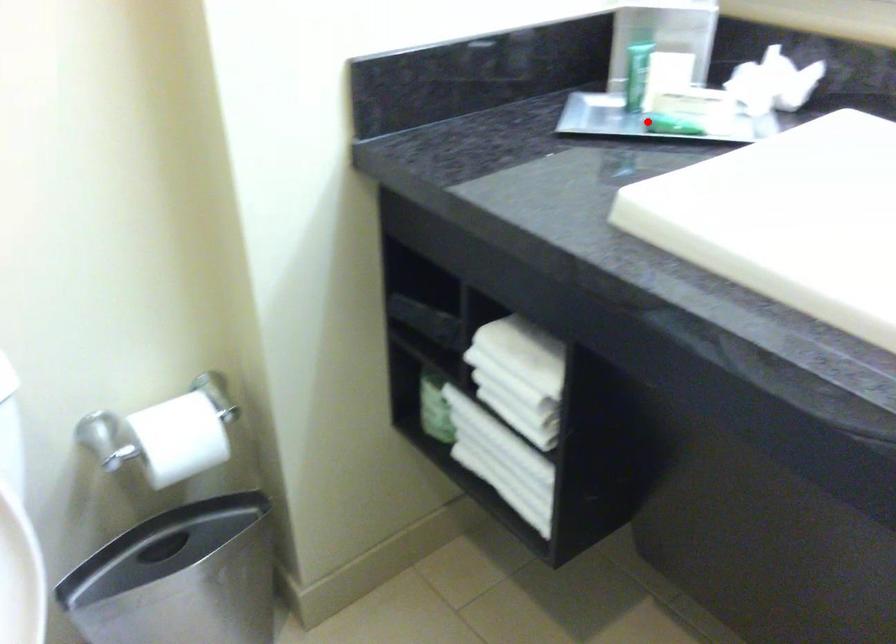
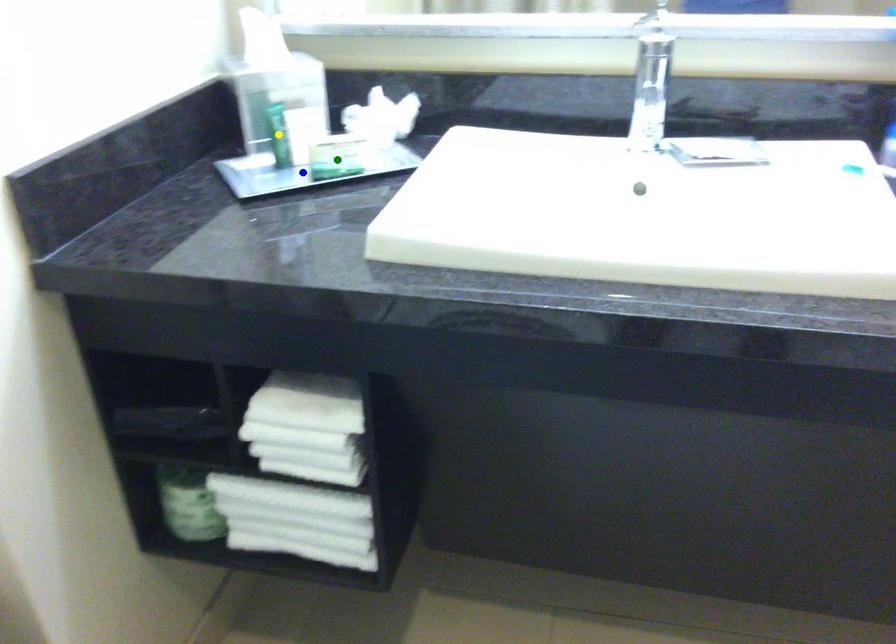
Question: I am providing you with two images of the same scene from different viewpoints. A red point is marked on the first image. You are given multiple points on the second image. In image 2, which mark is for the same physical point as the one in image 1?

Choices:
 (A) blue point
 (B) yellow point
 (C) green point

Answer: (A)